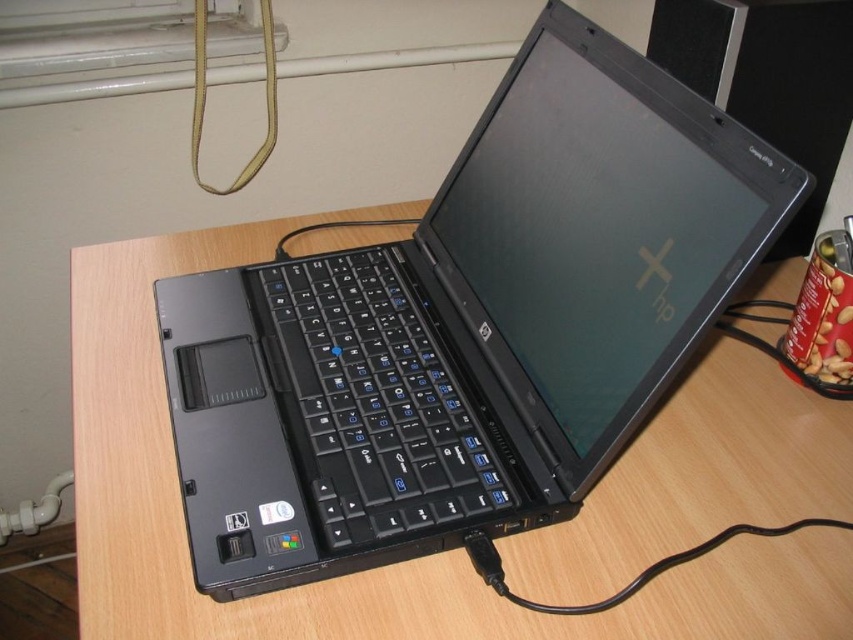
You are setting up a workspace and have a small desk. You need to place both the black plastic laptop at center and the black plastic keyboard at center on the desk. Given that the desk has limited space, which object should you place first to ensure both fit comfortably?

Since the black plastic laptop at center is bigger than the black plastic keyboard at center, you should place the black plastic laptop at center first to ensure both fit comfortably on the desk.

You are organizing a desk and want to stack the black plastic laptop at center on top of the black plastic keyboard at center. Based on their sizes, will this arrangement be stable?

The black plastic laptop at center has a greater height compared to the black plastic keyboard at center, so stacking the laptop on top of the keyboard may not be stable due to the laptop being taller and possibly less stable.